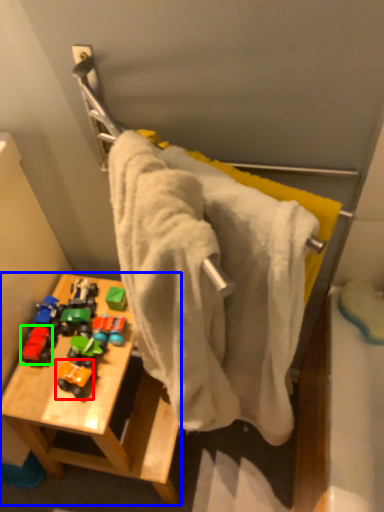
Question: Which object is positioned farthest from toy (highlighted by a red box)? Select from furniture (highlighted by a blue box) and toy (highlighted by a green box).

Choices:
 (A) furniture
 (B) toy

Answer: (A)